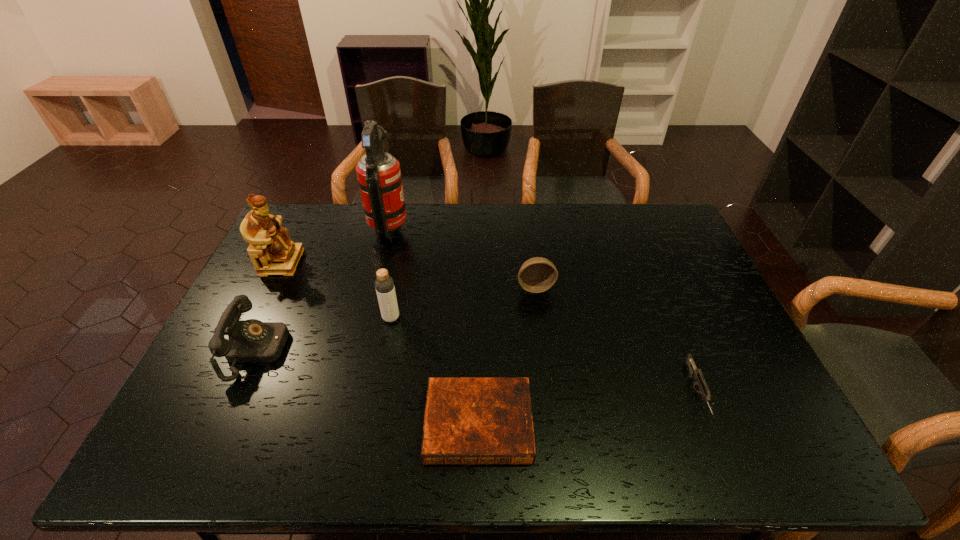
Identify the location of free space at the far edge of the desktop. The width and height of the screenshot is (960, 540). (469, 225).

In the image, there is a desktop. Identify the location of vacant space at the near edge. (379, 467).

This screenshot has width=960, height=540. In the image, there is a desktop. What are the coordinates of `vacant area at the left edge` in the screenshot? It's located at (228, 364).

Where is `free space at the right edge of the desktop`? The image size is (960, 540). free space at the right edge of the desktop is located at coordinates (773, 414).

Identify the location of vacant space at the far left corner. Image resolution: width=960 pixels, height=540 pixels. (284, 224).

In the image, there is a desktop. Where is `vacant space at the far right corner`? vacant space at the far right corner is located at coordinates (663, 205).

Where is `free spot between the farthest object and the figurine`? free spot between the farthest object and the figurine is located at coordinates (336, 245).

This screenshot has height=540, width=960. Find the location of `empty location between the shortest object and the second farthest object`. empty location between the shortest object and the second farthest object is located at coordinates (380, 343).

Where is `free space between the tallest object and the telephone`? This screenshot has width=960, height=540. free space between the tallest object and the telephone is located at coordinates pyautogui.click(x=324, y=289).

Image resolution: width=960 pixels, height=540 pixels. Identify the location of free spot between the bottle and the second shortest object. (543, 355).